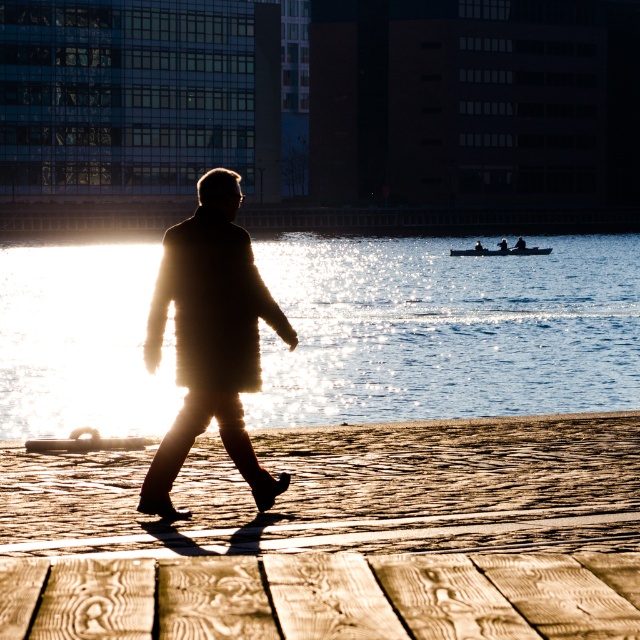
Question: Where is glistening water at center located in relation to wooden planks at lower center in the image?

Choices:
 (A) below
 (B) above

Answer: (B)

Question: Among these points, which one is farthest from the camera?

Choices:
 (A) (516, 246)
 (B) (180, 326)

Answer: (A)

Question: Does wooden planks at lower center appear under smooth black boat at center?

Choices:
 (A) no
 (B) yes

Answer: (B)

Question: Which of the following is the closest to the observer?

Choices:
 (A) wooden planks at lower center
 (B) smooth black boat at center
 (C) glistening water at center
 (D) silhouette wool coat at center

Answer: (A)

Question: Which object is farther from the camera taking this photo?

Choices:
 (A) glistening water at center
 (B) silhouette wool coat at center
 (C) smooth black boat at center
 (D) wooden planks at lower center

Answer: (C)

Question: In this image, where is wooden planks at lower center located relative to silhouette wool coat at center?

Choices:
 (A) below
 (B) above

Answer: (A)